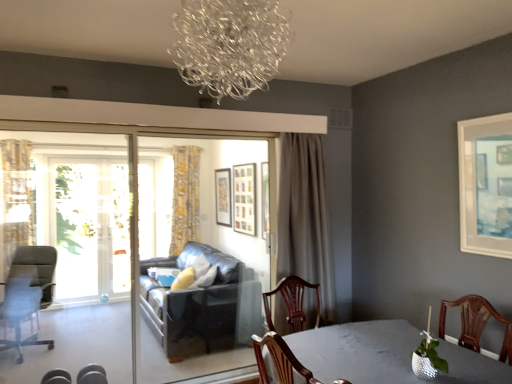
Question: Can you confirm if yellow floral fabric curtain at center, which appears as the 3th curtain when viewed from the front, is wider than white matte picture frame at upper right, marked as the 4th picture frame in a back-to-front arrangement?

Choices:
 (A) yes
 (B) no

Answer: (A)

Question: Does yellow floral fabric curtain at center, which ranks as the 2th curtain in right-to-left order, touch white matte picture frame at upper right, marked as the 4th picture frame in a back-to-front arrangement?

Choices:
 (A) no
 (B) yes

Answer: (A)

Question: From a real-world perspective, is yellow floral fabric curtain at center, which ranks as the 2th curtain in right-to-left order, on white matte picture frame at upper right, marked as the 4th picture frame in a back-to-front arrangement?

Choices:
 (A) no
 (B) yes

Answer: (A)

Question: Would you say yellow floral fabric curtain at center, which ranks as the 2th curtain in right-to-left order, is outside white matte picture frame at upper right, the first picture frame in the front-to-back sequence?

Choices:
 (A) yes
 (B) no

Answer: (A)

Question: Is the depth of yellow floral fabric curtain at center, which ranks as the 2th curtain in left-to-right order, less than that of white matte picture frame at upper right, which appears as the 4th picture frame when viewed from the left?

Choices:
 (A) no
 (B) yes

Answer: (A)

Question: In terms of size, does yellow floral fabric curtain at left, which appears as the first curtain when viewed from the left, appear bigger or smaller than clear glass chandelier at upper center?

Choices:
 (A) big
 (B) small

Answer: (A)

Question: Choose the correct answer: Is yellow floral fabric curtain at left, which appears as the first curtain when viewed from the left, inside clear glass chandelier at upper center or outside it?

Choices:
 (A) outside
 (B) inside

Answer: (A)

Question: Looking at their shapes, would you say yellow floral fabric curtain at left, which is counted as the second curtain, starting from the front, is wider or thinner than clear glass chandelier at upper center?

Choices:
 (A) wide
 (B) thin

Answer: (B)

Question: Visually, is yellow floral fabric curtain at left, which is counted as the second curtain, starting from the front, positioned to the left or to the right of clear glass chandelier at upper center?

Choices:
 (A) left
 (B) right

Answer: (A)

Question: Is wooden picture frame at center, which is counted as the 2th picture frame, starting from the back, situated inside shiny gray table at lower right or outside?

Choices:
 (A) inside
 (B) outside

Answer: (B)

Question: Considering the positions of wooden picture frame at center, which is the 2th picture frame from left to right, and shiny gray table at lower right in the image, is wooden picture frame at center, which is the 2th picture frame from left to right, taller or shorter than shiny gray table at lower right?

Choices:
 (A) tall
 (B) short

Answer: (A)

Question: Considering the relative positions of wooden picture frame at center, which is the 2th picture frame from left to right, and shiny gray table at lower right in the image provided, is wooden picture frame at center, which is the 2th picture frame from left to right, to the left or to the right of shiny gray table at lower right?

Choices:
 (A) left
 (B) right

Answer: (A)

Question: From the image's perspective, is wooden picture frame at center, which is counted as the 2th picture frame, starting from the back, above or below shiny gray table at lower right?

Choices:
 (A) below
 (B) above

Answer: (B)

Question: From their relative heights in the image, would you say gray fabric curtain at center, the first curtain viewed from the right, is taller or shorter than matte black chair at lower left, placed as the third chair when sorted from back to front?

Choices:
 (A) short
 (B) tall

Answer: (B)

Question: Looking at the image, does gray fabric curtain at center, positioned as the 3th curtain in back-to-front order, seem bigger or smaller compared to matte black chair at lower left, placed as the third chair when sorted from back to front?

Choices:
 (A) small
 (B) big

Answer: (B)